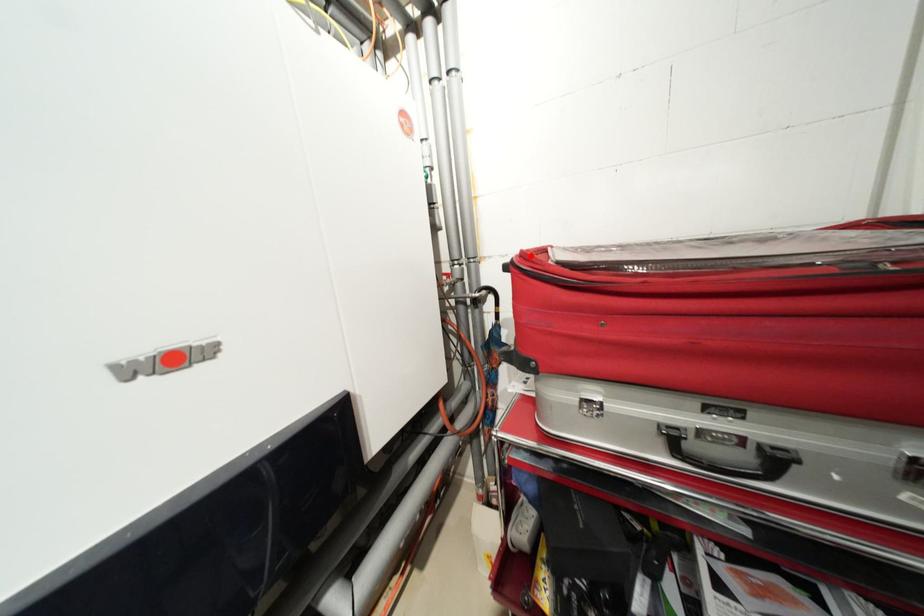
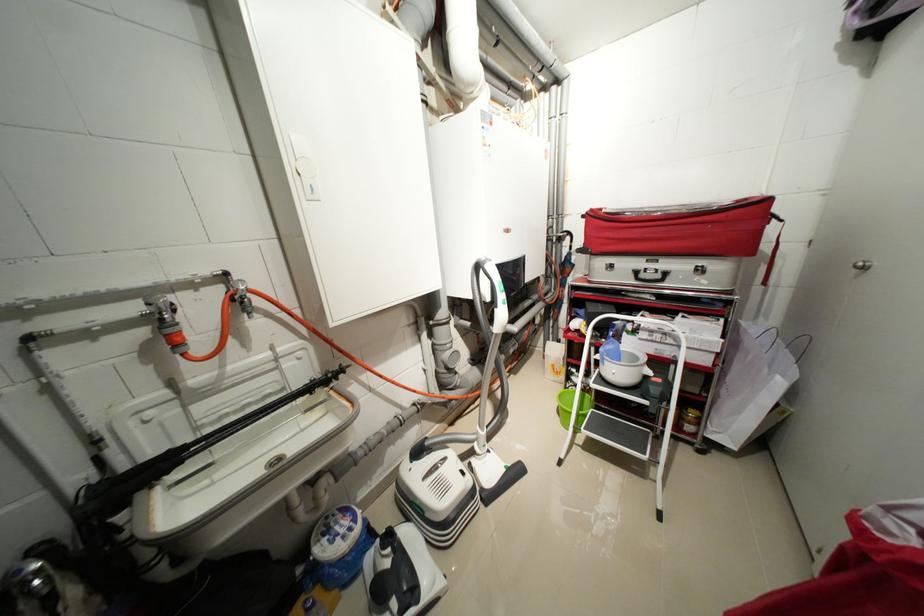
Locate, in the second image, the point that corresponds to the highlighted location in the first image.

(599, 211)